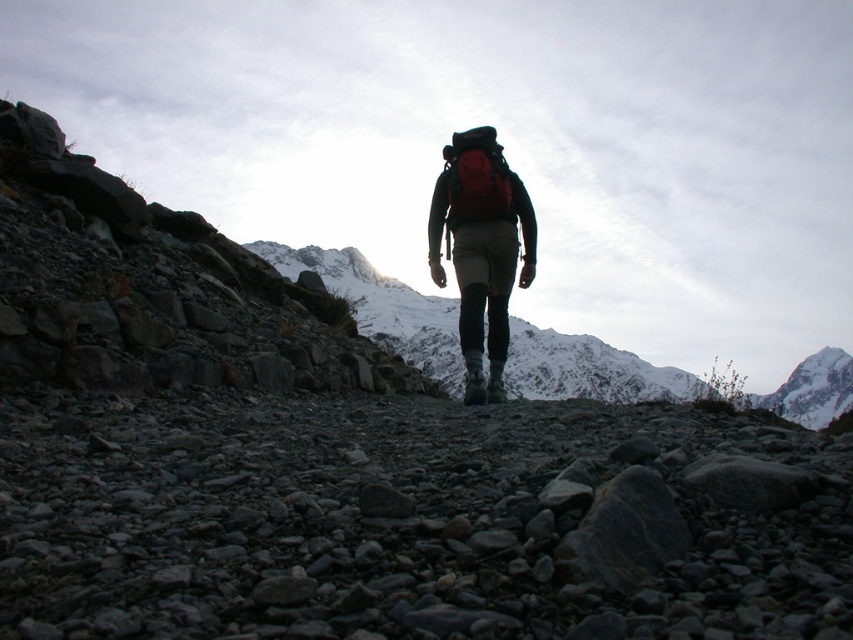
Question: Which point is farther to the camera?

Choices:
 (A) (845, 378)
 (B) (473, 179)

Answer: (A)

Question: Considering the relative positions of matte red backpack at center and red fabric backpack at center in the image provided, where is matte red backpack at center located with respect to red fabric backpack at center?

Choices:
 (A) left
 (B) right

Answer: (B)

Question: Which object appears closest to the camera in this image?

Choices:
 (A) red fabric backpack at center
 (B) matte red backpack at center

Answer: (B)

Question: Is matte red backpack at center to the right of red fabric backpack at center from the viewer's perspective?

Choices:
 (A) no
 (B) yes

Answer: (B)

Question: Which point is closer to the camera?

Choices:
 (A) (791, 412)
 (B) (480, 339)
 (C) (453, 186)

Answer: (B)

Question: Considering the relative positions of red fabric backpack at center and snowy white peak at upper right in the image provided, where is red fabric backpack at center located with respect to snowy white peak at upper right?

Choices:
 (A) above
 (B) below

Answer: (A)